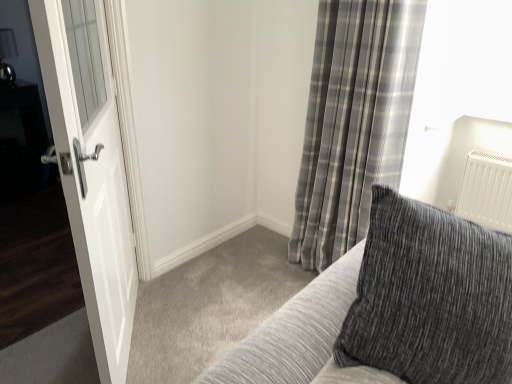
Question: From a real-world perspective, is textured gray pillow at upper right on top of white glossy door at left?

Choices:
 (A) yes
 (B) no

Answer: (A)

Question: Does textured gray pillow at upper right come behind white glossy door at left?

Choices:
 (A) no
 (B) yes

Answer: (A)

Question: Considering the relative sizes of textured gray pillow at upper right and white glossy door at left in the image provided, is textured gray pillow at upper right smaller than white glossy door at left?

Choices:
 (A) yes
 (B) no

Answer: (B)

Question: From a real-world perspective, is textured gray pillow at upper right located beneath white glossy door at left?

Choices:
 (A) no
 (B) yes

Answer: (A)

Question: From the image's perspective, is textured gray pillow at upper right located above white glossy door at left?

Choices:
 (A) yes
 (B) no

Answer: (B)

Question: Is textured gray pillow at upper right thinner than white glossy door at left?

Choices:
 (A) yes
 (B) no

Answer: (B)

Question: Considering the relative sizes of textured gray pillow at upper right and gray plaid curtain at upper right in the image provided, is textured gray pillow at upper right smaller than gray plaid curtain at upper right?

Choices:
 (A) no
 (B) yes

Answer: (B)

Question: Does textured gray pillow at upper right have a lesser width compared to gray plaid curtain at upper right?

Choices:
 (A) yes
 (B) no

Answer: (B)

Question: Does textured gray pillow at upper right have a greater width compared to gray plaid curtain at upper right?

Choices:
 (A) yes
 (B) no

Answer: (A)

Question: Is textured gray pillow at upper right positioned with its back to gray plaid curtain at upper right?

Choices:
 (A) yes
 (B) no

Answer: (A)

Question: Does textured gray pillow at upper right appear on the right side of gray plaid curtain at upper right?

Choices:
 (A) yes
 (B) no

Answer: (B)

Question: From the image's perspective, does textured gray pillow at upper right appear lower than gray plaid curtain at upper right?

Choices:
 (A) yes
 (B) no

Answer: (A)

Question: Is gray plaid curtain at upper right further to camera compared to textured gray pillow at upper right?

Choices:
 (A) yes
 (B) no

Answer: (A)